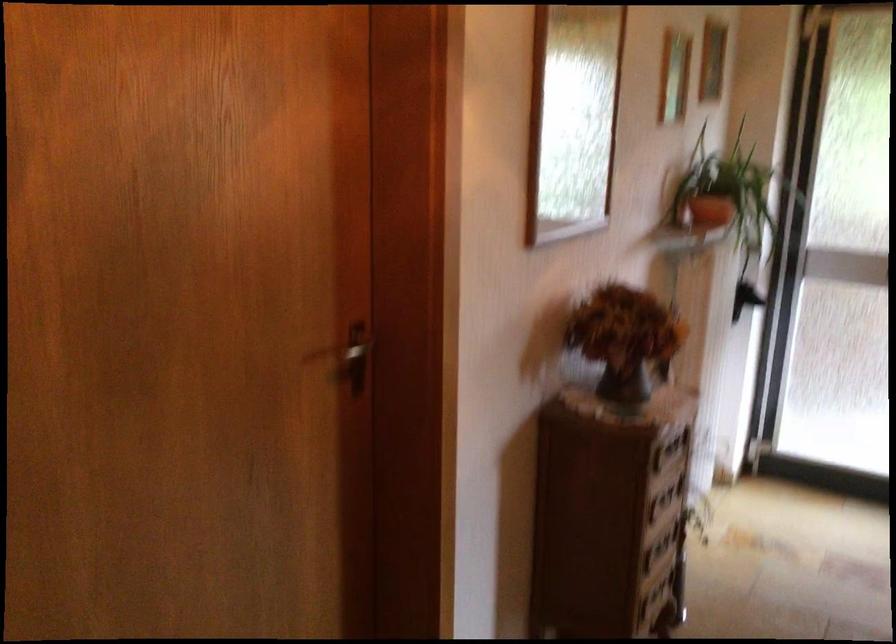
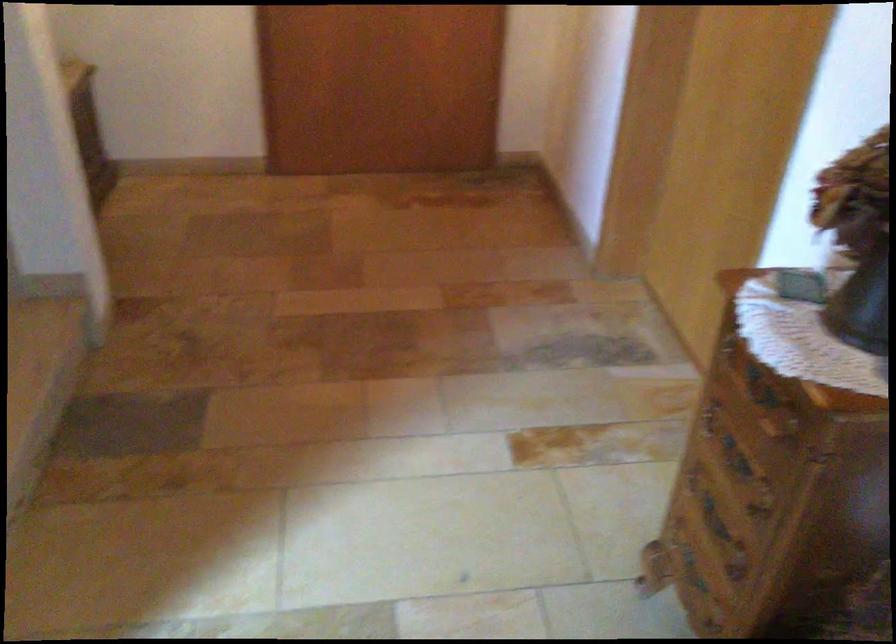
Where in the second image is the point corresponding to point 613,411 from the first image?

(863, 303)